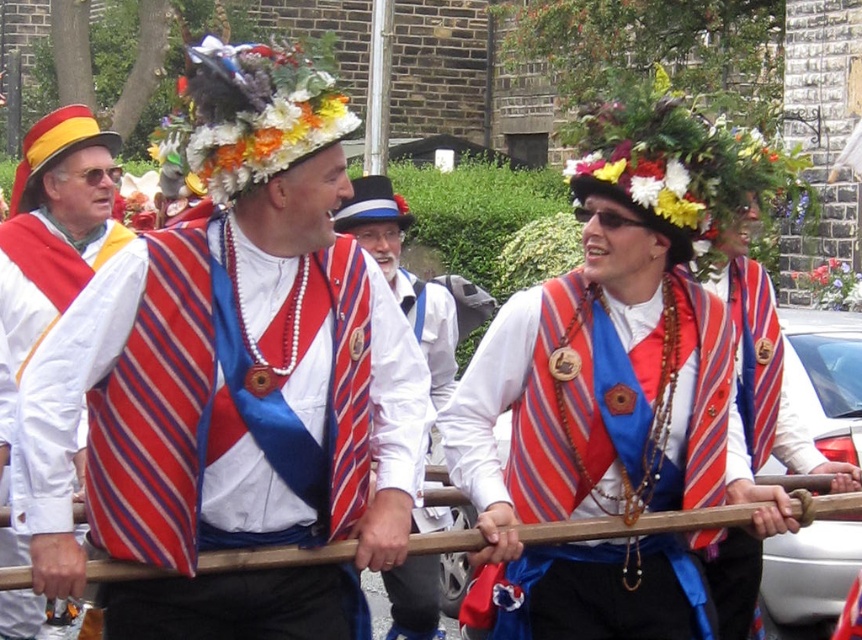
Which of these two, matte fabric vest at center or matte red vest at center, stands taller?

Standing taller between the two is matte fabric vest at center.

Does matte fabric vest at center appear under matte red vest at center?

Incorrect, matte fabric vest at center is not positioned below matte red vest at center.

This screenshot has width=862, height=640. In order to click on matte fabric vest at center in this screenshot , I will do `click(232, 381)`.

Is point (116, 248) positioned in front of point (409, 561)?

No, (116, 248) is behind (409, 561).

Who is taller, matte white robe at left or matte red vest at center?

matte white robe at left is taller.

At what (x,y) coordinates should I click in order to perform the action: click on matte white robe at left. Please return your answer as a coordinate pair (x, y). The height and width of the screenshot is (640, 862). Looking at the image, I should click on (55, 225).

Is matte fabric vest at center positioned before matte white robe at left?

Yes, matte fabric vest at center is in front of matte white robe at left.

Who is more distant from viewer, (x=44, y=493) or (x=100, y=156)?

The point (x=100, y=156) is behind.

Who is more forward, (116, 518) or (26, 288)?

Point (116, 518) is in front.

The image size is (862, 640). Find the location of `matte fabric vest at center`. matte fabric vest at center is located at coordinates (232, 381).